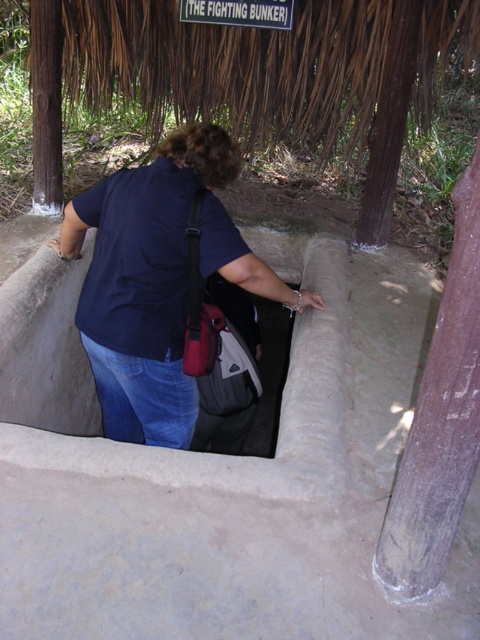
Can you confirm if gray concrete trench at center is shorter than dark blue shirt at center?

Incorrect, gray concrete trench at center's height does not fall short of dark blue shirt at center's.

Does point (143, 582) lie behind point (189, 436)?

That is False.

I want to click on gray concrete trench at center, so click(220, 476).